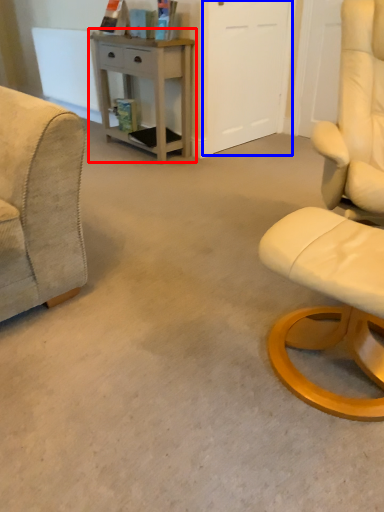
Question: Which of the following is the farthest to the observer, desk (highlighted by a red box) or glass door (highlighted by a blue box)?

Choices:
 (A) desk
 (B) glass door

Answer: (B)